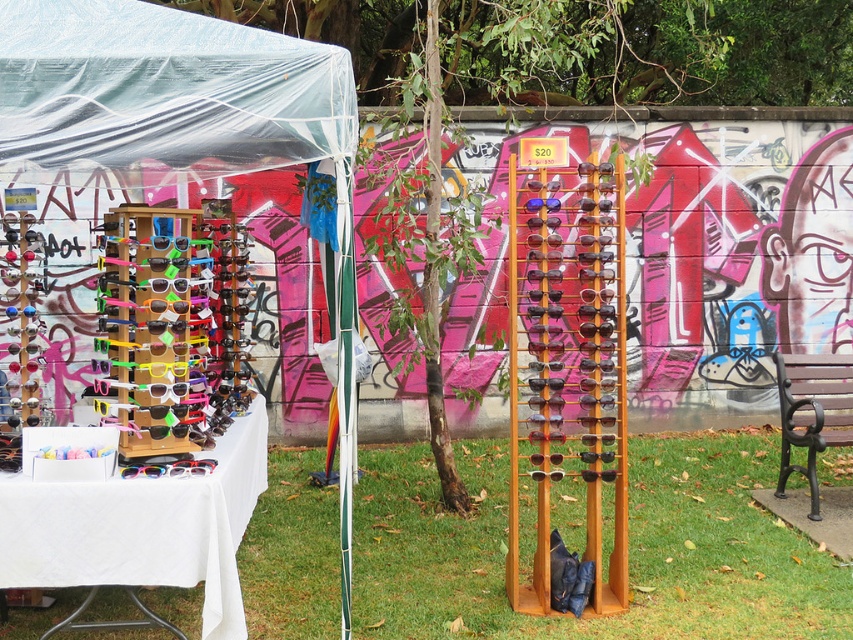
Question: Which of the following is the farthest from the observer?

Choices:
 (A) (193, 465)
 (B) (212, 518)
 (C) (215, 108)

Answer: (A)

Question: Which object is the farthest from the wooden sunglasses stand at left?

Choices:
 (A) rainbow plastic sunglasses at lower left
 (B) brown wooden park bench at lower right

Answer: (B)

Question: In this image, where is brown wooden park bench at lower right located relative to rainbow plastic sunglasses at lower left?

Choices:
 (A) right
 (B) left

Answer: (A)

Question: Can you confirm if wooden sunglasses stand at left is positioned below rainbow plastic sunglasses at lower left?

Choices:
 (A) no
 (B) yes

Answer: (A)

Question: Based on their relative distances, which object is nearer to the white fabric table at left?

Choices:
 (A) brown wooden park bench at lower right
 (B) wooden sunglasses stand at left

Answer: (B)

Question: Does white fabric table at left appear on the left side of rainbow plastic sunglasses at lower left?

Choices:
 (A) no
 (B) yes

Answer: (B)